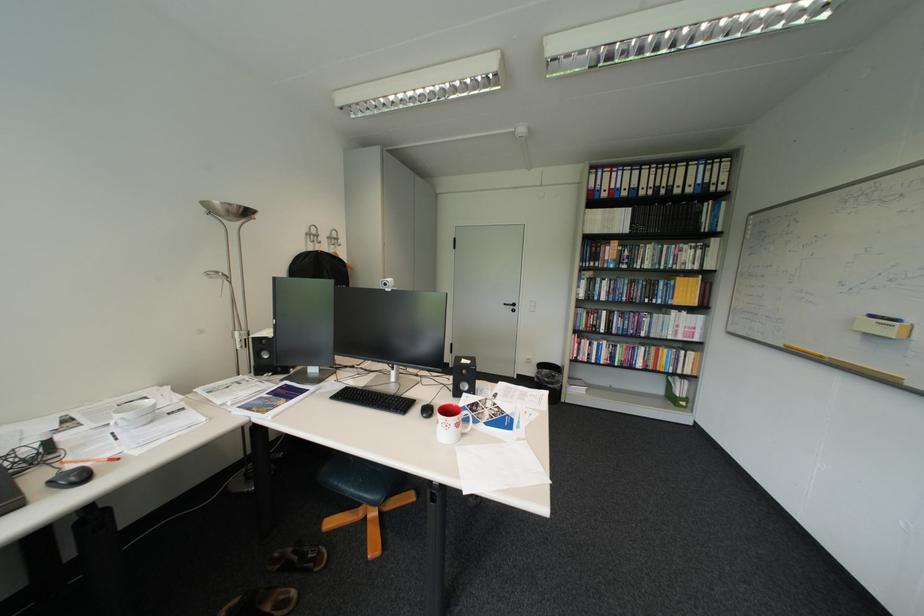
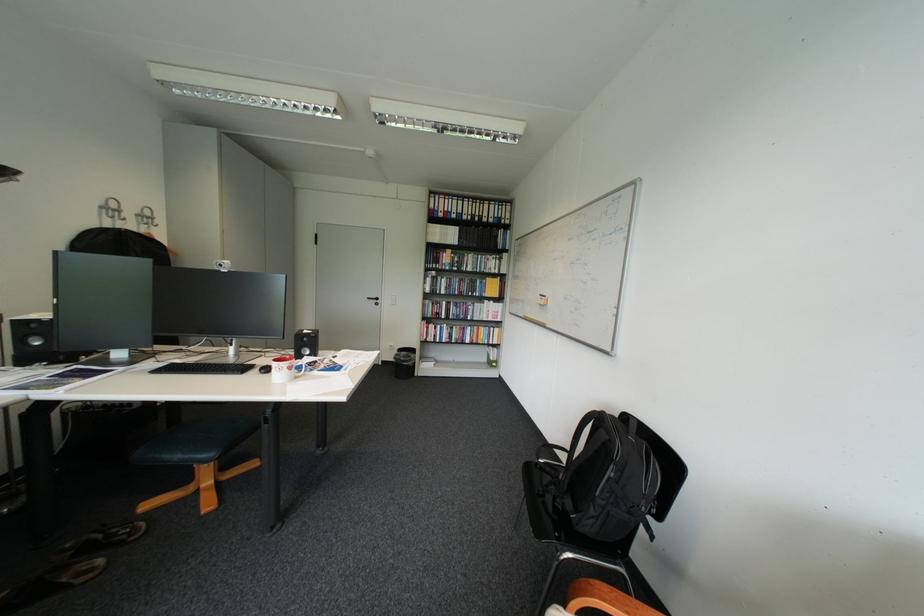
Where in the second image is the point corresponding to point 655,188 from the first image?

(477, 215)